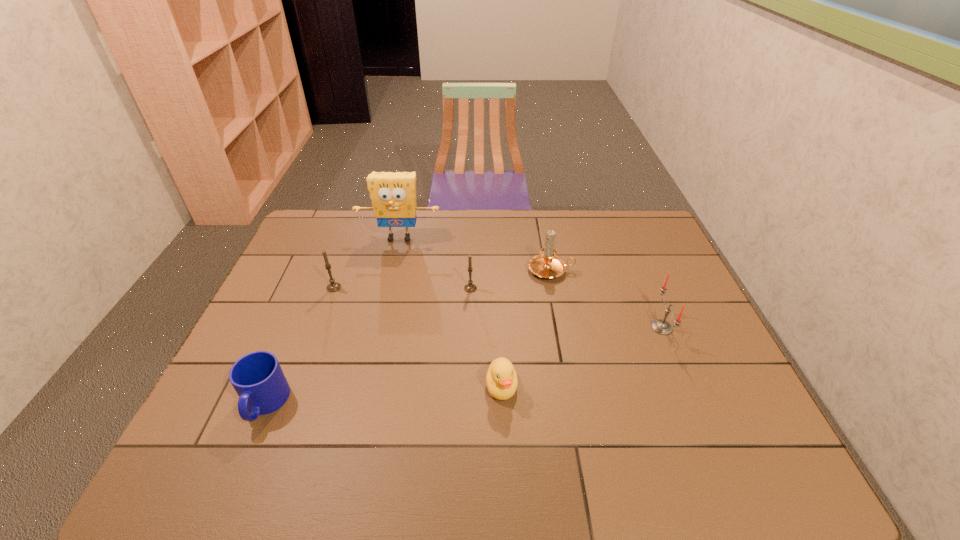
I want to click on free space in the image that satisfies the following two spatial constraints: 1. on the front-facing side of the nearest candle; 2. on the face of the duckling, so tap(686, 387).

Image resolution: width=960 pixels, height=540 pixels. I want to click on vacant position in the image that satisfies the following two spatial constraints: 1. on the front-facing side of the nearest candle; 2. on the side with the handle of the mug, so click(694, 404).